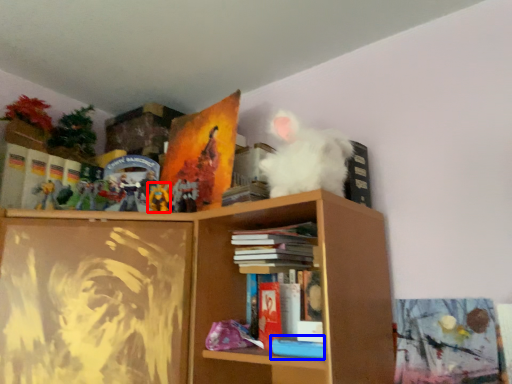
Question: Which of the following is the farthest to the observer, toy (highlighted by a red box) or book (highlighted by a blue box)?

Choices:
 (A) toy
 (B) book

Answer: (A)